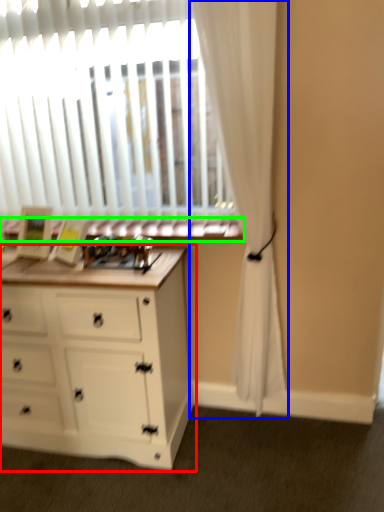
Question: Which object is positioned farthest from chest of drawers (highlighted by a red box)? Select from curtain (highlighted by a blue box) and window sill (highlighted by a green box).

Choices:
 (A) curtain
 (B) window sill

Answer: (A)